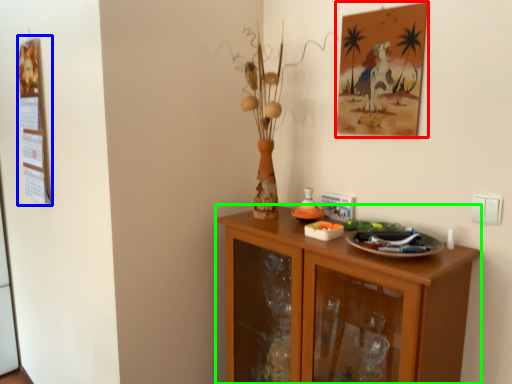
Question: Considering the real-world distances, which object is closest to picture frame (highlighted by a red box)? bulletin board (highlighted by a blue box) or cabinetry (highlighted by a green box).

Choices:
 (A) bulletin board
 (B) cabinetry

Answer: (B)